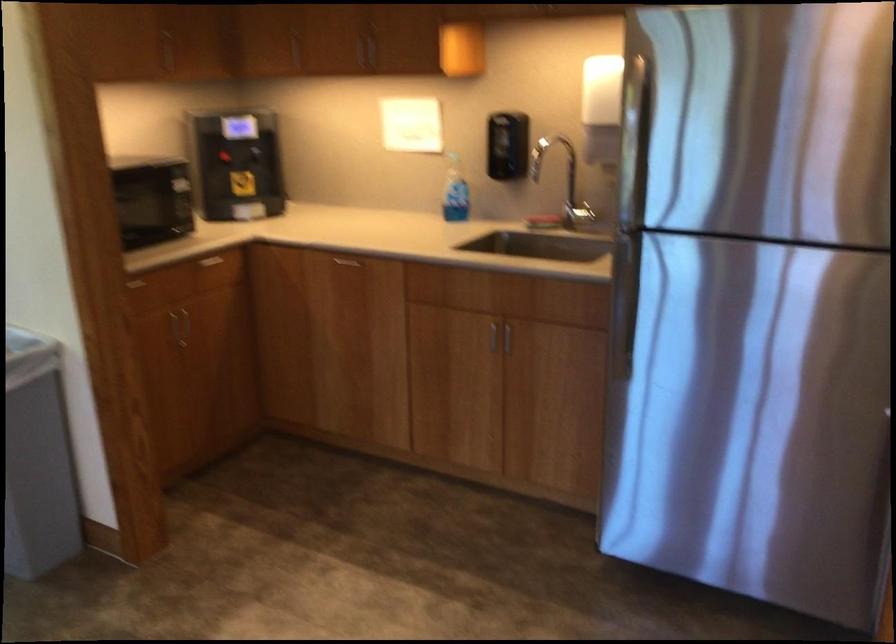
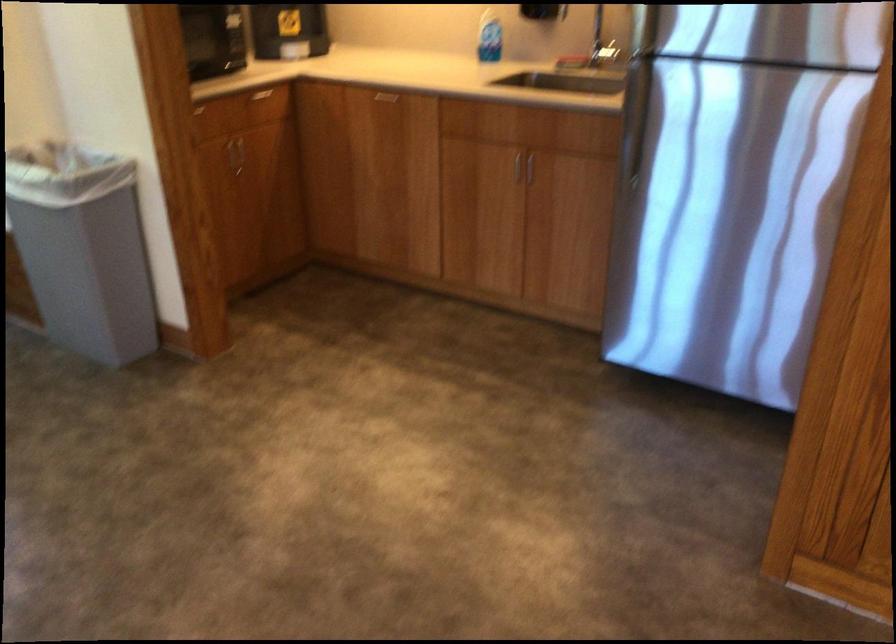
Find the pixel in the second image that matches [492,335] in the first image.

(515, 165)